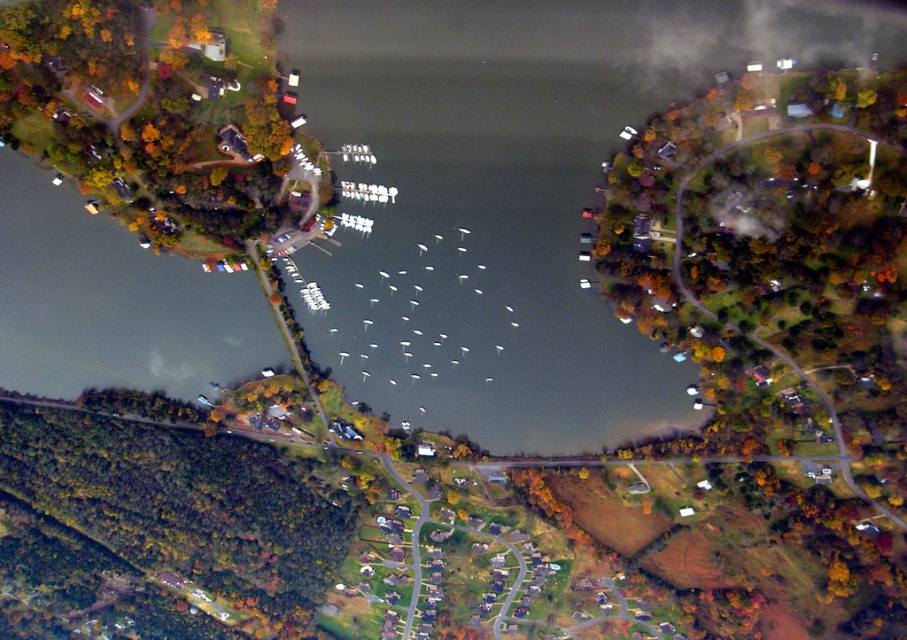
Based on the scene description, where is the green leafy trees at center located in the image?

The green leafy trees at center are located at point (783, 320) in the image.

You are a landscape architect designing a walking path between the green leafy trees at center and the green leafy trees at lower left. The path must be at least 100 meters long to accommodate a scenic route. Is the current distance sufficient for your plan?

The distance between the green leafy trees at center and the green leafy trees at lower left is 102.33 meters, which is more than the required 100 meters. Therefore, the current distance is sufficient for the walking path design.

Consider the image. You are a drone operator flying over the lakeside community. You need to capture a photo of both the point at coordinates (783,134) and the point at (250,497). Which point should you fly closer to first to ensure both are in frame?

You should fly closer to point (783,134) first because it is closer to the camera than point (250,497), allowing you to adjust the frame to include both points effectively.